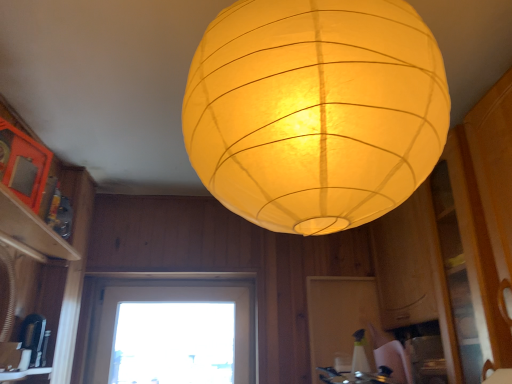
Question: Is point coord(437,129) closer or farther from the camera than point coord(24,241)?

Choices:
 (A) closer
 (B) farther

Answer: (A)

Question: Considering their positions, is matte yellow paper lantern at center located in front of or behind matte wood shelf at upper left?

Choices:
 (A) front
 (B) behind

Answer: (A)

Question: Considering the real-world distances, which object is farthest from the black plastic coffee maker at lower left?

Choices:
 (A) transparent glass window at center
 (B) metallic silver gas stove at lower center
 (C) matte wood shelf at upper left
 (D) matte yellow paper lantern at center

Answer: (D)

Question: Based on their relative distances, which object is farther from the matte yellow paper lantern at center?

Choices:
 (A) matte wood shelf at upper left
 (B) transparent glass window at center
 (C) metallic silver gas stove at lower center
 (D) black plastic coffee maker at lower left

Answer: (B)